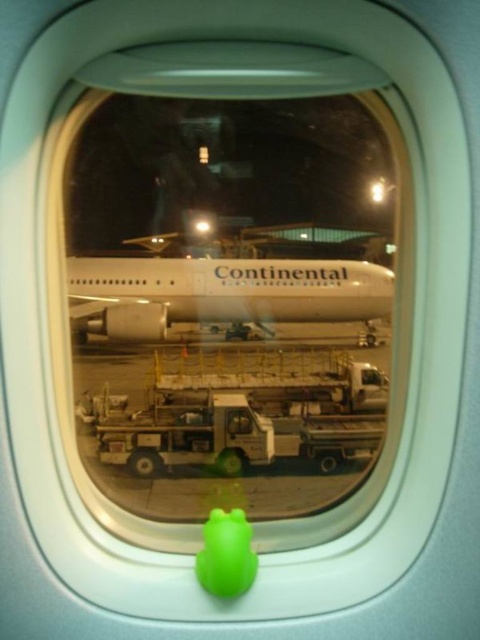
Question: Which of the following is the farthest from the observer?

Choices:
 (A) (200, 552)
 (B) (146, 332)

Answer: (B)

Question: Does white glossy airplane at center have a larger size compared to green rubber duck at center?

Choices:
 (A) yes
 (B) no

Answer: (A)

Question: Considering the relative positions of white glossy airplane at center and green rubber duck at center in the image provided, where is white glossy airplane at center located with respect to green rubber duck at center?

Choices:
 (A) right
 (B) left

Answer: (B)

Question: Is white glossy airplane at center in front of green rubber duck at center?

Choices:
 (A) yes
 (B) no

Answer: (B)

Question: Which object is farther from the camera taking this photo?

Choices:
 (A) white glossy airplane at center
 (B) green rubber duck at center

Answer: (A)